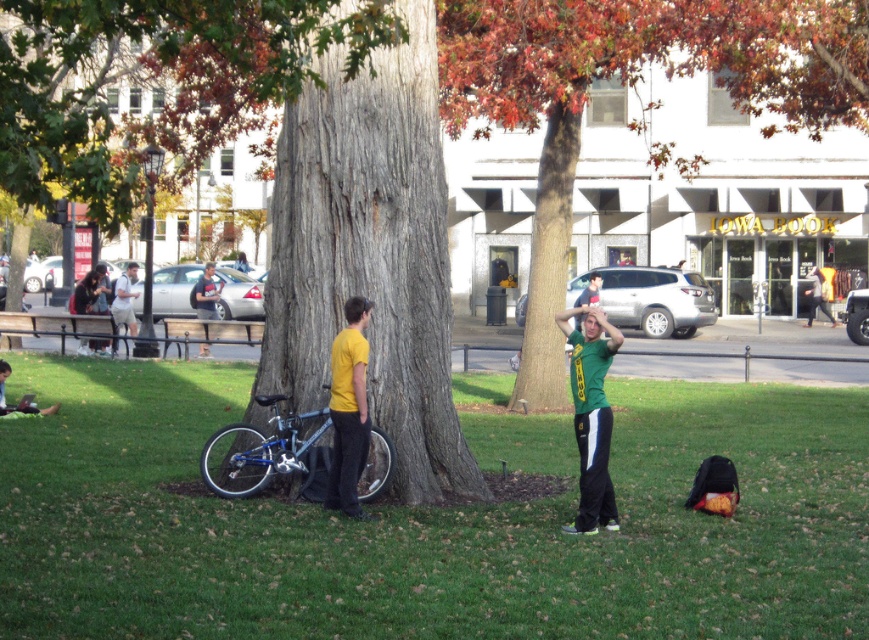
Is gray textured tree trunk at center closer to camera compared to shiny blue bicycle at center?

No, it is not.

Can you confirm if gray textured tree trunk at center is taller than shiny blue bicycle at center?

Indeed, gray textured tree trunk at center has a greater height compared to shiny blue bicycle at center.

Locate an element on the screen. The height and width of the screenshot is (640, 869). gray textured tree trunk at center is located at coordinates (370, 253).

Locate an element on the screen. Image resolution: width=869 pixels, height=640 pixels. gray textured tree trunk at center is located at coordinates (370, 253).

Who is lower down, light brown leather jacket at left or matte black shirt at center?

matte black shirt at center is lower down.

Can you confirm if light brown leather jacket at left is positioned below matte black shirt at center?

No.

The width and height of the screenshot is (869, 640). I want to click on light brown leather jacket at left, so click(x=125, y=300).

Based on the photo, can you confirm if gray textured tree trunk at center is wider than light brown leather jacket at left?

Incorrect, gray textured tree trunk at center's width does not surpass light brown leather jacket at left's.

Is point (423, 230) positioned in front of point (125, 294)?

Yes.

Does point (462, 480) lie in front of point (111, 310)?

Yes.

This screenshot has height=640, width=869. Find the location of `gray textured tree trunk at center`. gray textured tree trunk at center is located at coordinates (370, 253).